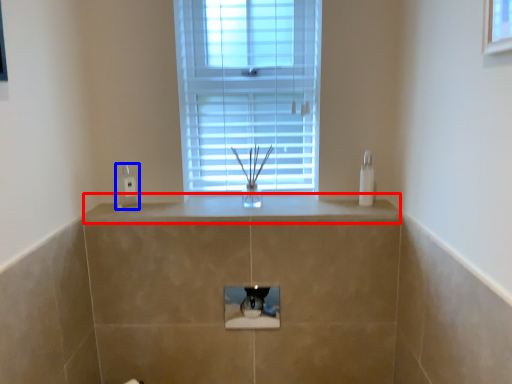
Question: Which point is closer to the camera, counter top (highlighted by a red box) or electric outlet (highlighted by a blue box)?

Choices:
 (A) counter top
 (B) electric outlet

Answer: (A)